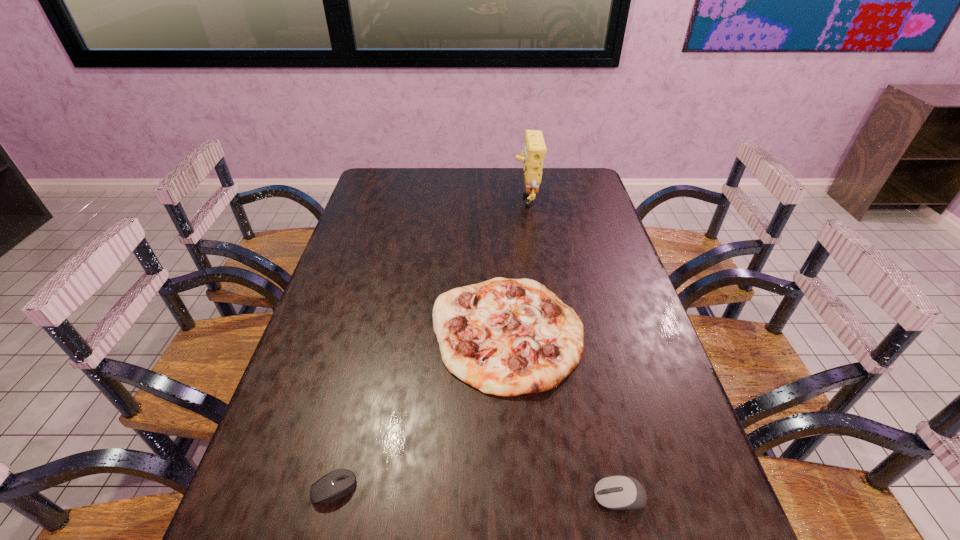
Locate an element on the screen. The width and height of the screenshot is (960, 540). sponge is located at coordinates (533, 155).

The width and height of the screenshot is (960, 540). I want to click on the farthest object, so click(533, 155).

Identify the location of the third shortest object. This screenshot has height=540, width=960. (506, 337).

Locate an element on the screen. The width and height of the screenshot is (960, 540). pizza is located at coordinates (506, 337).

Locate an element on the screen. Image resolution: width=960 pixels, height=540 pixels. the third tallest object is located at coordinates (618, 492).

Find the location of a particular element. The image size is (960, 540). the right computer equipment is located at coordinates (618, 492).

The width and height of the screenshot is (960, 540). Identify the location of the left computer equipment. (337, 484).

I want to click on the shortest object, so click(x=337, y=484).

Locate an element on the screen. The height and width of the screenshot is (540, 960). vacant space situated on the face of the tallest object is located at coordinates (478, 198).

What are the coordinates of `vacant space situated on the face of the tallest object` in the screenshot? It's located at (446, 198).